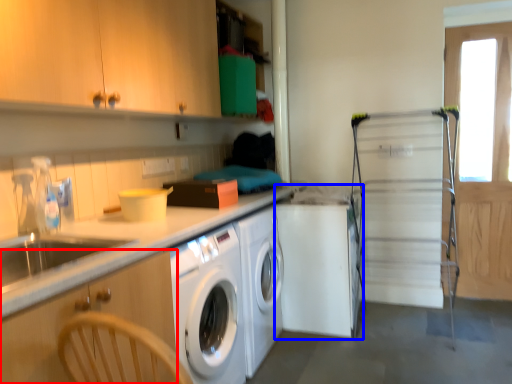
Question: Among these objects, which one is farthest to the camera, cabinetry (highlighted by a red box) or washing machine (highlighted by a blue box)?

Choices:
 (A) cabinetry
 (B) washing machine

Answer: (B)